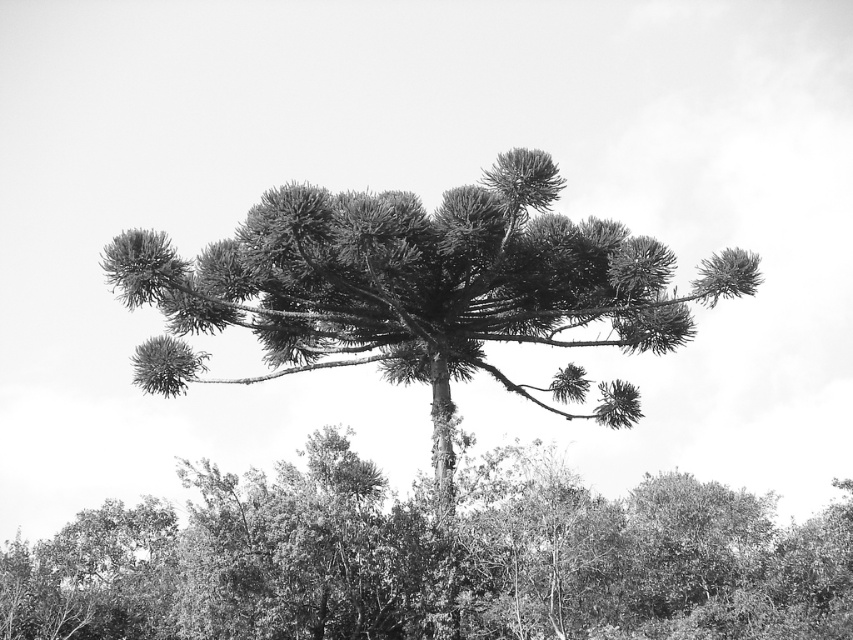
You are an environmental scientist analyzing the black and white photo of a forest. You observe the dark green textured tree at center and the dark green textured pine at center. Which of these two trees has a greater width?

The dark green textured tree at center has a greater width than the dark green textured pine at center according to the description provided.

You are an environmental scientist studying the spatial arrangement of plants in a forest. You observe the dark green textured tree at center and the dark green textured pine at center. Which plant is located to the right of the other?

The dark green textured tree at center is positioned on the right side of dark green textured pine at center.

You are standing in a forest and see the dark green textured tree at center. If you want to take a photo of it with your camera that has a maximum focus range of 25 meters, will you be able to capture it clearly?

The dark green textured tree at center is 28.68 meters away from viewer, which exceeds the camera maximum focus range of 25 meters. Therefore, you won not be able to capture it clearly.